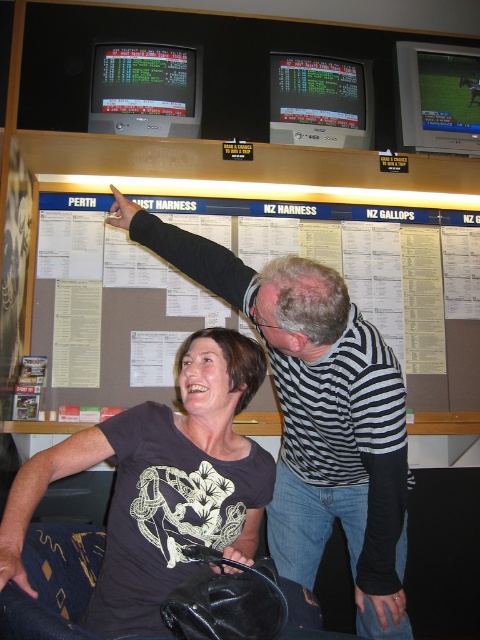
You are standing at the betting board and want to touch both points on the board. The first point is at position (379, 358) and the second point is at (120, 580). If you start at the first point, which direction should you move your hand to reach the second point?

To move from point (379, 358) to point (120, 580), you should move your hand to the right and down since point (120, 580) is located to the right and below point (379, 358).

You are a photographer trying to capture a photo of the striped shirt at upper center and the white paperboard at upper center. If you want to ensure both are fully visible in the frame, which object should you adjust your camera focus to prioritize in terms of size?

The striped shirt at upper center is narrower than the white paperboard at upper center, so you should prioritize focusing on the striped shirt at upper center to ensure it fits within the frame while still capturing the larger white paperboard at upper center.